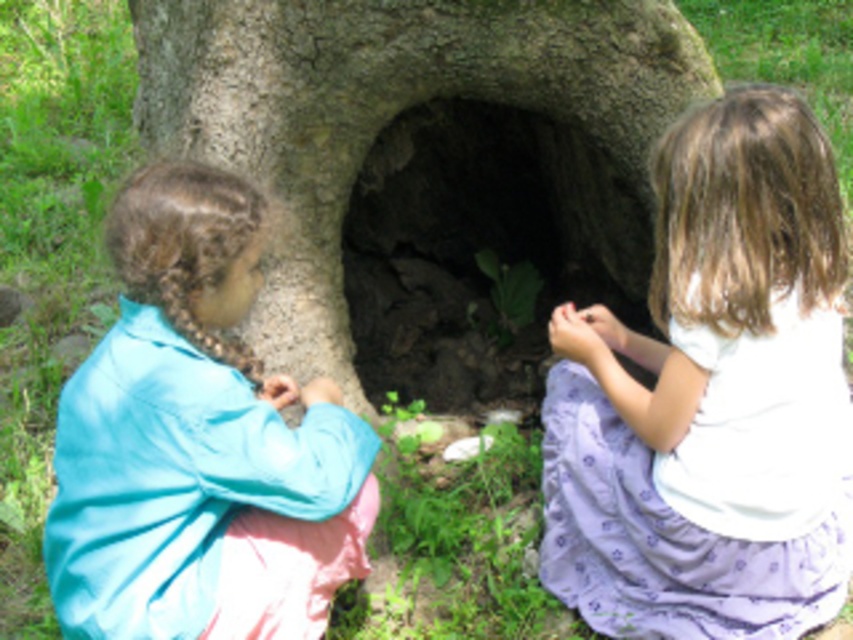
Question: Does white cotton shirt at center have a larger size compared to blue fabric shirt at left?

Choices:
 (A) yes
 (B) no

Answer: (A)

Question: Considering the real-world distances, which object is closest to the white cotton shirt at center?

Choices:
 (A) dark stone hole at center
 (B) blue fabric shirt at left

Answer: (B)

Question: Where is white cotton shirt at center located in relation to blue fabric shirt at left in the image?

Choices:
 (A) right
 (B) left

Answer: (A)

Question: Among these points, which one is farthest from the camera?

Choices:
 (A) (106, 451)
 (B) (448, 109)
 (C) (831, 502)

Answer: (B)

Question: Which object is closer to the camera taking this photo?

Choices:
 (A) dark stone hole at center
 (B) white cotton shirt at center

Answer: (B)

Question: Is white cotton shirt at center wider than blue fabric shirt at left?

Choices:
 (A) no
 (B) yes

Answer: (B)